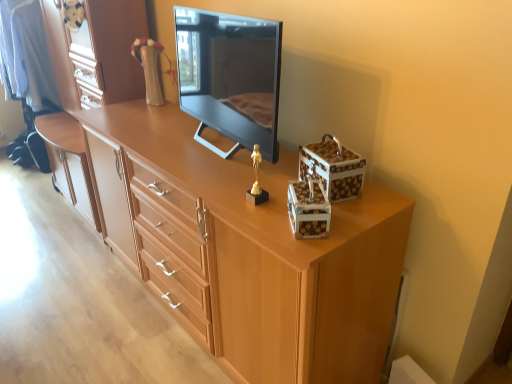
Identify the location of vacant space that's between gold metallic statue at center and white glossy storage box at upper right, marked as the second storage box in a back-to-front arrangement. The width and height of the screenshot is (512, 384). (274, 215).